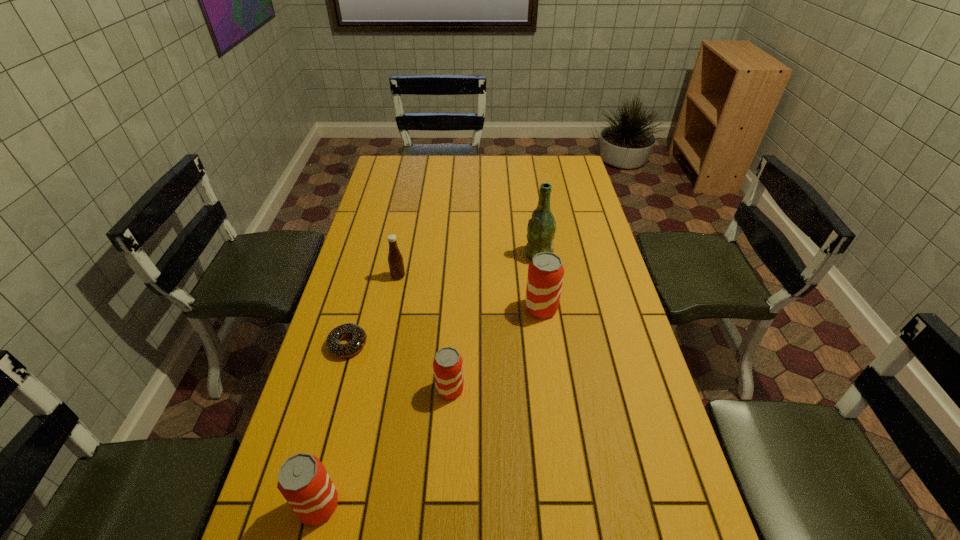
Locate an element on the screen. object that is at the near edge is located at coordinates (303, 480).

Find the location of `beer can situated at the left edge`. beer can situated at the left edge is located at coordinates (303, 480).

Locate an element on the screen. The height and width of the screenshot is (540, 960). doughnut that is at the left edge is located at coordinates (333, 345).

Find the location of a particular element. Image resolution: width=960 pixels, height=540 pixels. Tabasco sauce at the left edge is located at coordinates (395, 260).

Identify the location of object that is at the near left corner. The image size is (960, 540). (303, 480).

Image resolution: width=960 pixels, height=540 pixels. What are the coordinates of `vacant area at the far edge` in the screenshot? It's located at (468, 156).

Where is `free space at the left edge of the desktop`? The image size is (960, 540). free space at the left edge of the desktop is located at coordinates (381, 217).

At what (x,y) coordinates should I click in order to perform the action: click on vacant space at the right edge of the desktop. Please return your answer as a coordinate pair (x, y). Image resolution: width=960 pixels, height=540 pixels. Looking at the image, I should click on (572, 240).

Image resolution: width=960 pixels, height=540 pixels. In order to click on vacant space at the near left corner of the desktop in this screenshot , I will do tap(324, 523).

The height and width of the screenshot is (540, 960). I want to click on vacant space that is in between the doughnut and the farthest object, so click(x=444, y=300).